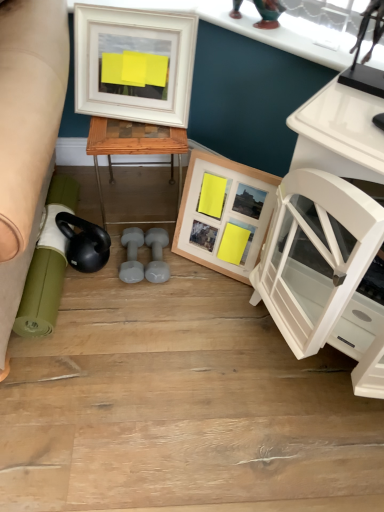
The height and width of the screenshot is (512, 384). I want to click on vacant area located to the right-hand side of gray rubber dumbbell at center, the first dumbbell when ordered from left to right, so click(x=193, y=279).